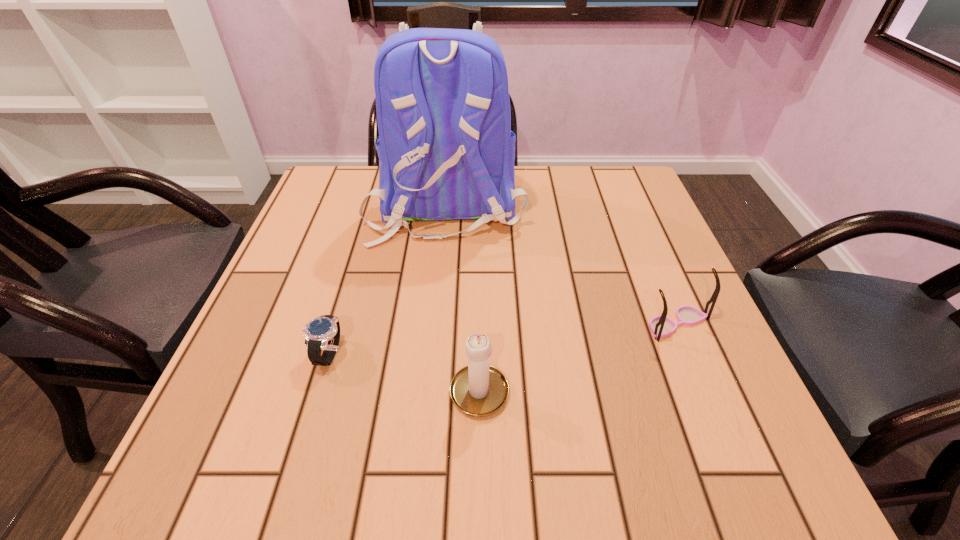
Image resolution: width=960 pixels, height=540 pixels. What are the coordinates of `blank area in the image that satisfies the following two spatial constraints: 1. on the back of the second shortest object; 2. on the left side of the tallest object` in the screenshot? It's located at pos(435,323).

Find the location of a particular element. The height and width of the screenshot is (540, 960). vacant space that satisfies the following two spatial constraints: 1. on the back of the farthest object; 2. on the right side of the third tallest object is located at coordinates (435, 323).